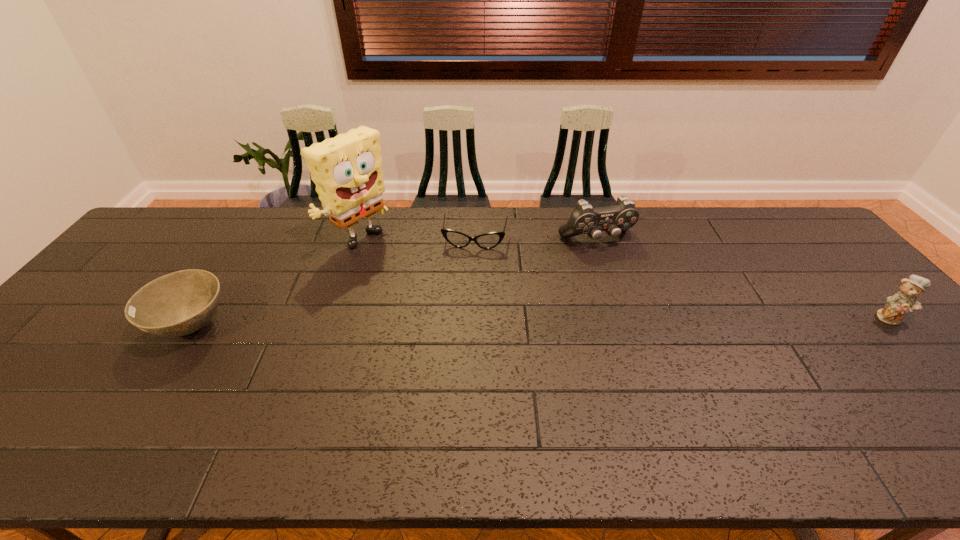
Where is `vacant space that is in between the fourth tallest object and the rightmost object`? vacant space that is in between the fourth tallest object and the rightmost object is located at coordinates click(x=541, y=322).

Identify the location of free space that is in between the fourth tallest object and the teddy bear. (541, 322).

Image resolution: width=960 pixels, height=540 pixels. I want to click on vacant area between the teddy bear and the second object from right to left, so click(x=743, y=278).

Image resolution: width=960 pixels, height=540 pixels. Find the location of `unoccupied area between the spectacles and the control`. unoccupied area between the spectacles and the control is located at coordinates (536, 239).

At what (x,y) coordinates should I click in order to perform the action: click on vacant area that lies between the tallest object and the second shortest object. Please return your answer as a coordinate pair (x, y). The width and height of the screenshot is (960, 540). Looking at the image, I should click on (276, 285).

Image resolution: width=960 pixels, height=540 pixels. What are the coordinates of `vacant space that's between the fourth tallest object and the teddy bear` in the screenshot? It's located at (541, 322).

The height and width of the screenshot is (540, 960). Find the location of `free spot between the sponge and the second shortest object`. free spot between the sponge and the second shortest object is located at coordinates (276, 285).

This screenshot has width=960, height=540. What are the coordinates of `vacant space in between the rightmost object and the fourth object from right to left` in the screenshot? It's located at (625, 280).

This screenshot has height=540, width=960. I want to click on object that is the third closest to the second shortest object, so click(x=584, y=219).

Identify the location of the third closest object to the teddy bear. The width and height of the screenshot is (960, 540). (347, 170).